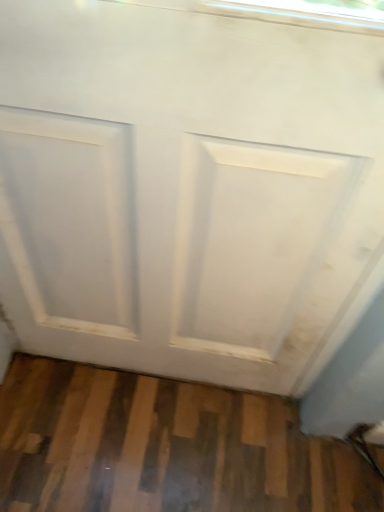
Identify the location of natural wood floor at lower center. The height and width of the screenshot is (512, 384). (164, 447).

What is the approximate height of natural wood floor at lower center?

The height of natural wood floor at lower center is 1.87 inches.

Image resolution: width=384 pixels, height=512 pixels. Describe the element at coordinates (164, 447) in the screenshot. I see `natural wood floor at lower center` at that location.

Locate an element on the screen. Image resolution: width=384 pixels, height=512 pixels. natural wood floor at lower center is located at coordinates (164, 447).